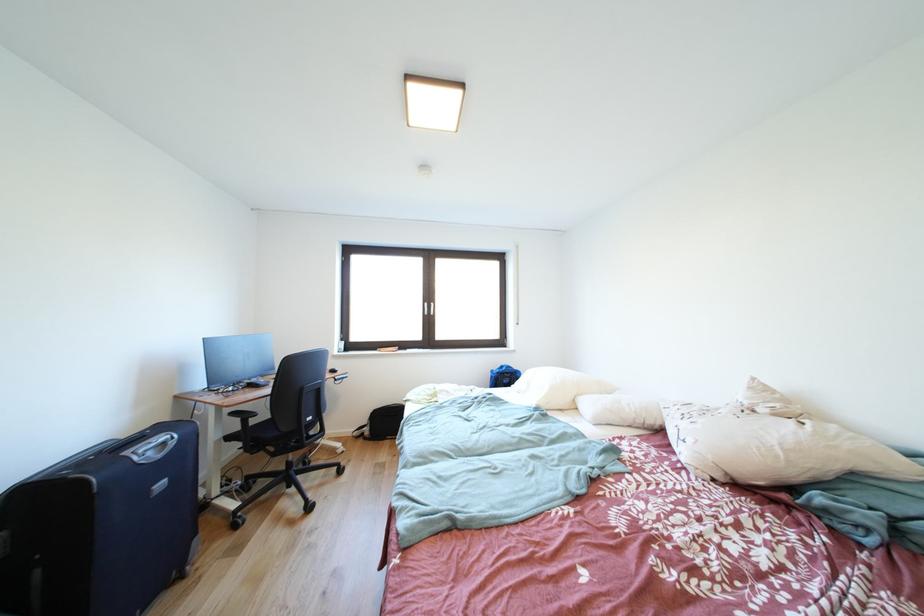
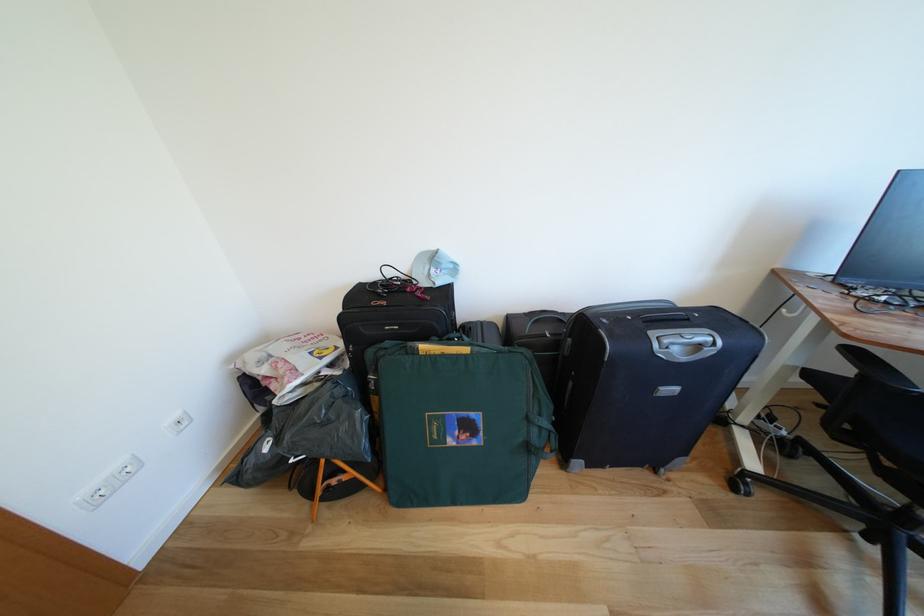
The point at (173, 448) is marked in the first image. Where is the corresponding point in the second image?

(707, 351)